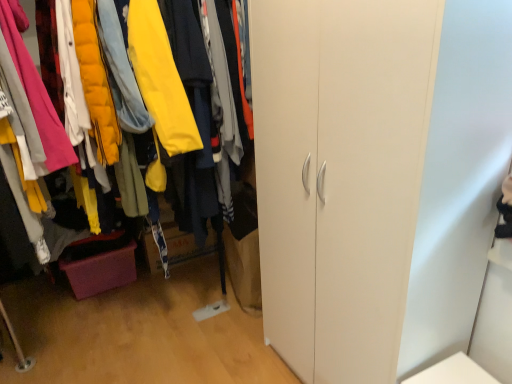
At what (x,y) coordinates should I click in order to perform the action: click on vacant space underneath white matte cabinet at center (from a real-world perspective). Please return your answer as a coordinate pair (x, y). This screenshot has width=512, height=384. Looking at the image, I should click on (166, 322).